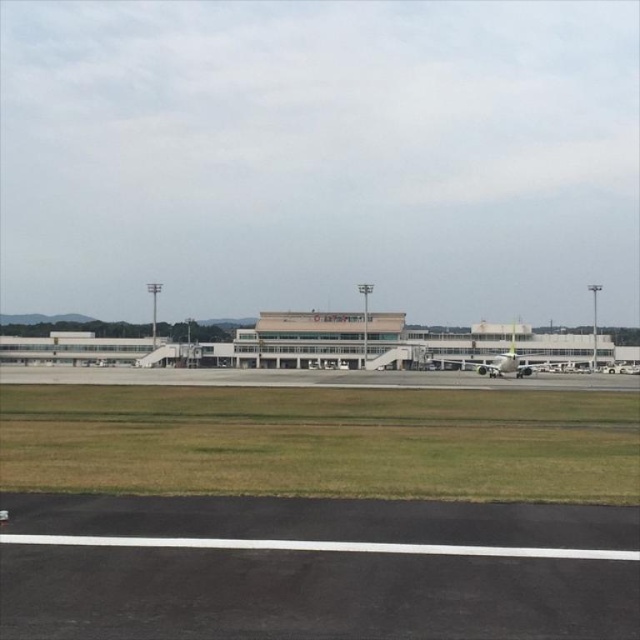
You are standing on the tarmac and want to walk to the terminal building. You have two points to choose from as starting points. The first is point (305,508) and the second is point (470,356). Which starting point is closer to the terminal building?

Point (470,356) is closer to the terminal building because it is farther from the viewer compared to point (305,508), which is closer to the viewer. Since the terminal building is in the background, the point farther from the viewer would be nearer to it.